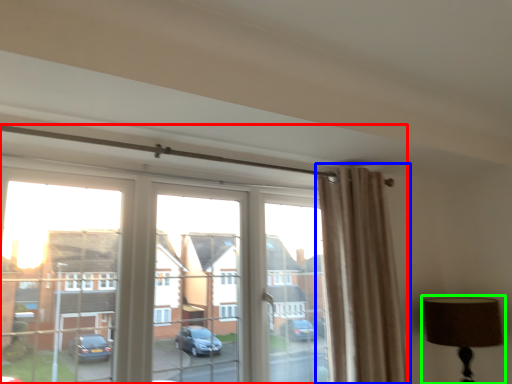
Question: Based on their relative distances, which object is farther from window (highlighted by a red box)? Choose from curtain (highlighted by a blue box) and table lamp (highlighted by a green box).

Choices:
 (A) curtain
 (B) table lamp

Answer: (B)